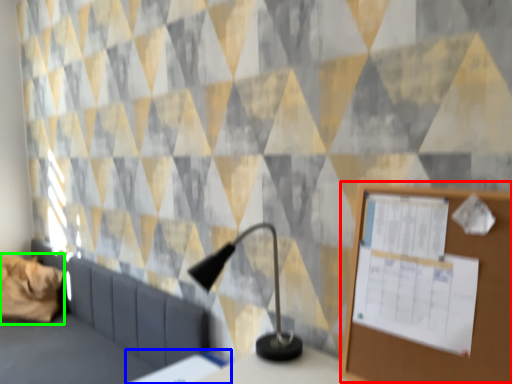
Question: Based on their relative distances, which object is nearer to bulletin board (highlighted by a red box)? Choose from table (highlighted by a blue box) and pillow (highlighted by a green box).

Choices:
 (A) table
 (B) pillow

Answer: (A)